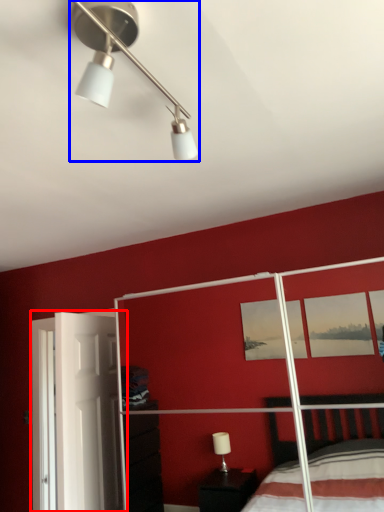
Question: Which point is closer to the camera, screen door (highlighted by a red box) or lamp (highlighted by a blue box)?

Choices:
 (A) screen door
 (B) lamp

Answer: (B)